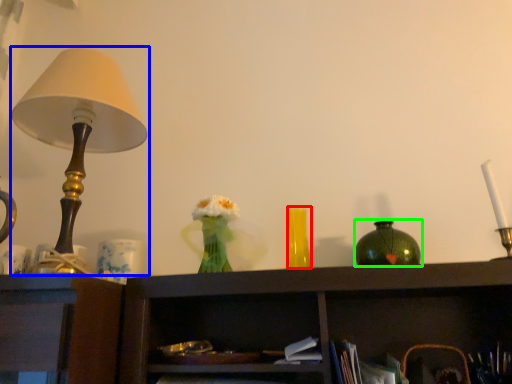
Question: Which object is the farthest from vase (highlighted by a red box)? Choose among these: lamp (highlighted by a blue box) or vase (highlighted by a green box).

Choices:
 (A) lamp
 (B) vase

Answer: (A)